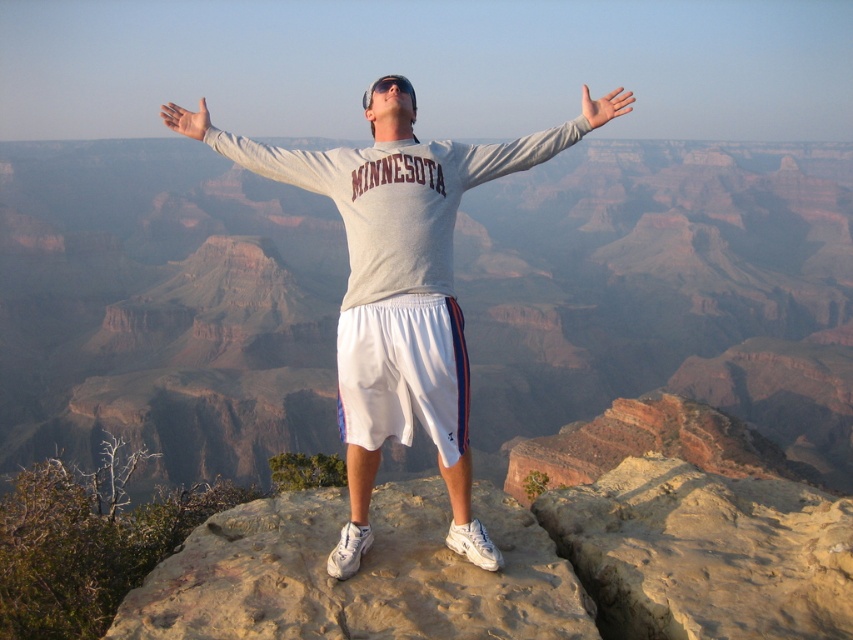
Which of these two, smooth beige rock at center or white matte hand at center, stands taller?

white matte hand at center is taller.

Where is `smooth beige rock at center`? smooth beige rock at center is located at coordinates (358, 573).

Between point (364, 241) and point (601, 122), which one is positioned behind?

Point (601, 122)

Who is higher up, gray cotton sweatshirt at center or white matte hand at upper center?

white matte hand at upper center is above.

The image size is (853, 640). Identify the location of gray cotton sweatshirt at center. (399, 294).

Where is `gray cotton sweatshirt at center`? Image resolution: width=853 pixels, height=640 pixels. gray cotton sweatshirt at center is located at coordinates (399, 294).

Describe the element at coordinates (535, 141) in the screenshot. I see `gray matte arm at center` at that location.

Who is more forward, (570, 124) or (201, 116)?

Point (570, 124) is more forward.

Which is behind, point (460, 148) or point (184, 125)?

The point (184, 125) is behind.

Locate an element on the screen. This screenshot has width=853, height=640. gray matte arm at center is located at coordinates (535, 141).